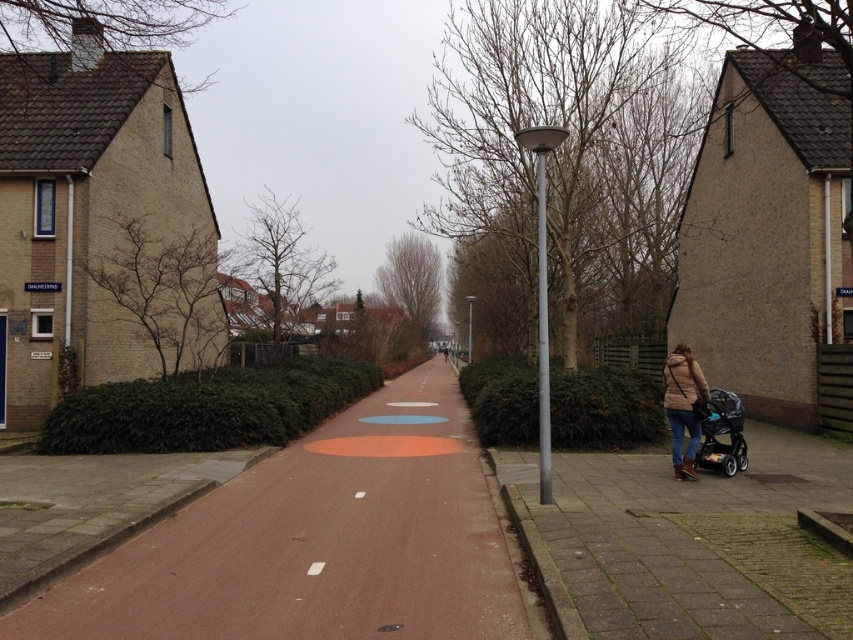
Question: Which point is farther to the camera?

Choices:
 (A) smooth concrete path at center
 (B) matte black stroller at lower right

Answer: (B)

Question: Which point is farther from the camera taking this photo?

Choices:
 (A) (401, 612)
 (B) (706, 444)

Answer: (B)

Question: Which object appears farthest from the camera in this image?

Choices:
 (A) smooth concrete path at center
 (B) matte brown jacket at lower right

Answer: (B)

Question: Considering the relative positions of smooth concrete path at center and matte brown jacket at lower right in the image provided, where is smooth concrete path at center located with respect to matte brown jacket at lower right?

Choices:
 (A) left
 (B) right

Answer: (A)

Question: Can you confirm if smooth concrete path at center is smaller than matte brown jacket at lower right?

Choices:
 (A) yes
 (B) no

Answer: (B)

Question: Can you confirm if matte brown jacket at lower right is bigger than matte black stroller at lower right?

Choices:
 (A) no
 (B) yes

Answer: (A)